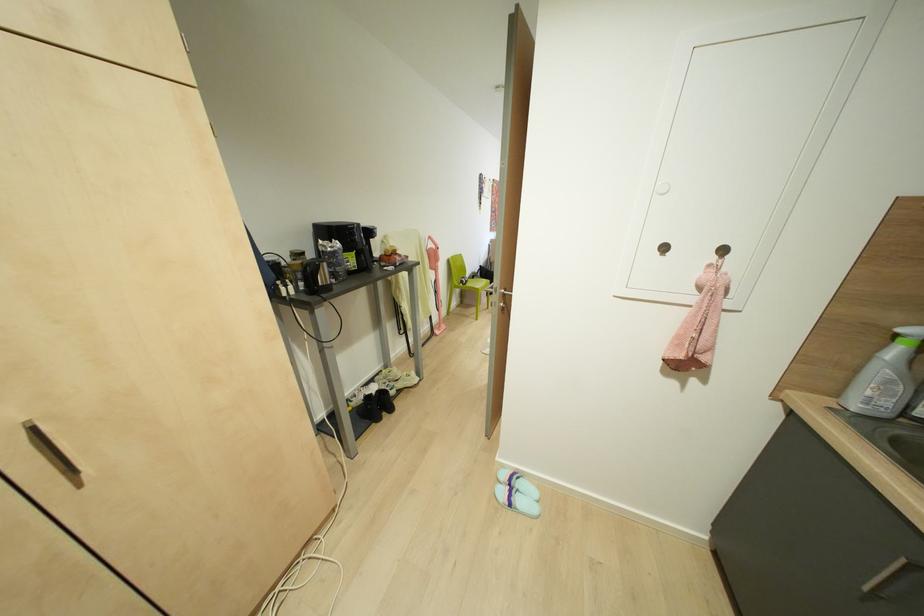
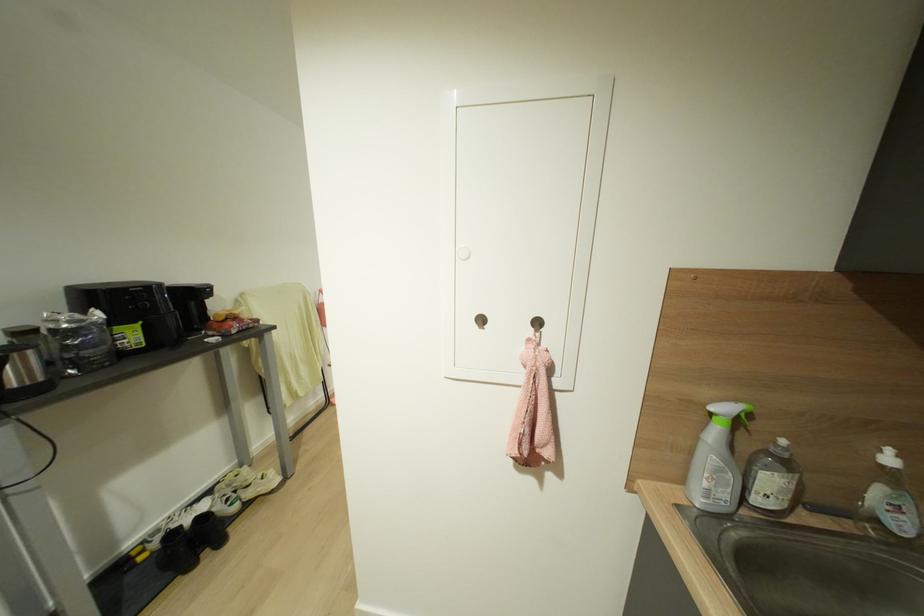
Where in the second image is the point corresponding to [327,288] from the first image?

(39, 389)